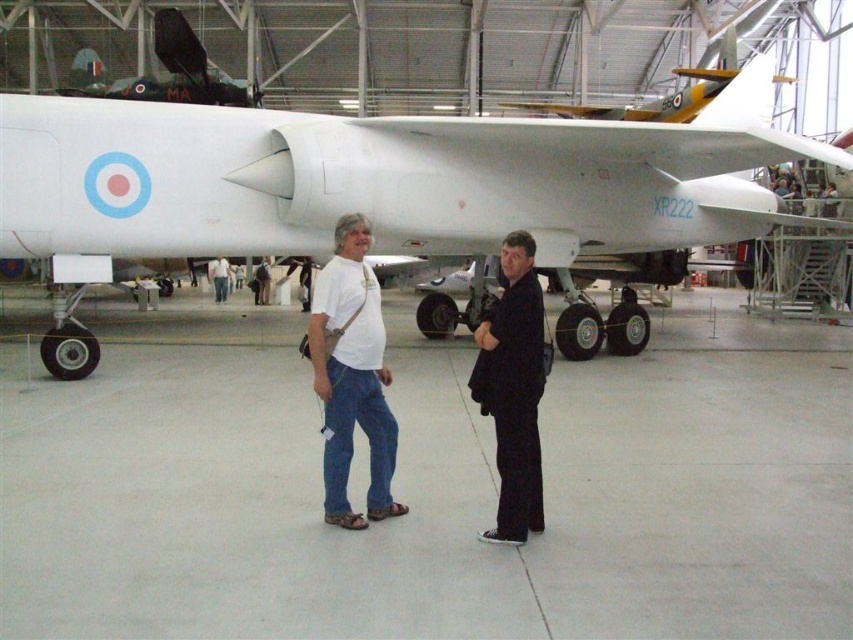
Question: Can you confirm if white cotton t-shirt at center is positioned below black matte suit at center?

Choices:
 (A) yes
 (B) no

Answer: (B)

Question: Which object is farther from the camera taking this photo?

Choices:
 (A) white matte airplane at center
 (B) white cotton t-shirt at center

Answer: (A)

Question: From the image, what is the correct spatial relationship of white matte airplane at center in relation to white cotton t-shirt at center?

Choices:
 (A) above
 (B) below

Answer: (A)

Question: Is white cotton t-shirt at center positioned at the back of black matte suit at center?

Choices:
 (A) no
 (B) yes

Answer: (B)

Question: Which object is closer to the camera taking this photo?

Choices:
 (A) white cotton t-shirt at center
 (B) white matte airplane at center

Answer: (A)

Question: Which of the following is the closest to the observer?

Choices:
 (A) (55, 157)
 (B) (366, 420)
 (C) (519, 420)

Answer: (C)